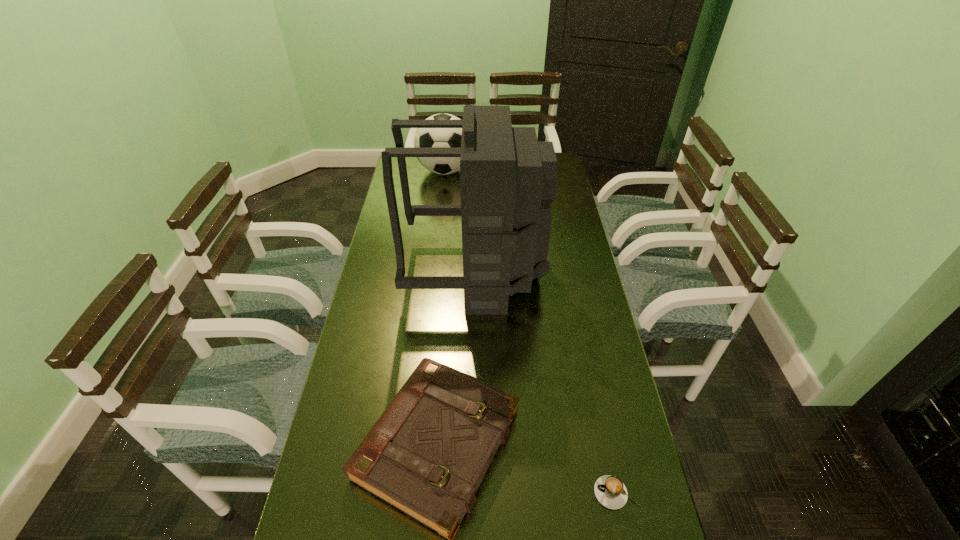
You are a GUI agent. You are given a task and a screenshot of the screen. Output one action in this format:
    pyautogui.click(x=<x>, y=<y>)
    Task: Click on the vacant space situated with the handle on the side of the rightmost object
    This screenshot has width=960, height=540.
    Given the screenshot: What is the action you would take?
    pyautogui.click(x=456, y=492)

Find the location of a particular element. object present at the far edge is located at coordinates pyautogui.click(x=424, y=137).

Locate an element on the screen. backpack at the left edge is located at coordinates (508, 179).

You are a GUI agent. You are given a task and a screenshot of the screen. Output one action in this format:
    pyautogui.click(x=<x>, y=<y>)
    Task: Click on the soccer ball at the left edge
    The height and width of the screenshot is (540, 960).
    Given the screenshot: What is the action you would take?
    pyautogui.click(x=424, y=137)

Where is `object located in the right edge section of the desktop`? Image resolution: width=960 pixels, height=540 pixels. object located in the right edge section of the desktop is located at coordinates (610, 491).

Find the location of a particular element. Image resolution: width=960 pixels, height=540 pixels. object located at the far left corner is located at coordinates (424, 137).

In the image, there is a desktop. At what (x,y) coordinates should I click in order to perform the action: click on free space at the left edge. Please return your answer as a coordinate pair (x, y). This screenshot has height=540, width=960. Looking at the image, I should click on (361, 341).

At what (x,y) coordinates should I click in order to perform the action: click on free space at the right edge of the desktop. Please return your answer as a coordinate pair (x, y). Looking at the image, I should click on (615, 382).

Identify the location of vacant space at the far right corner. (563, 166).

The image size is (960, 540). I want to click on free spot between the second farthest object and the farthest object, so click(x=460, y=221).